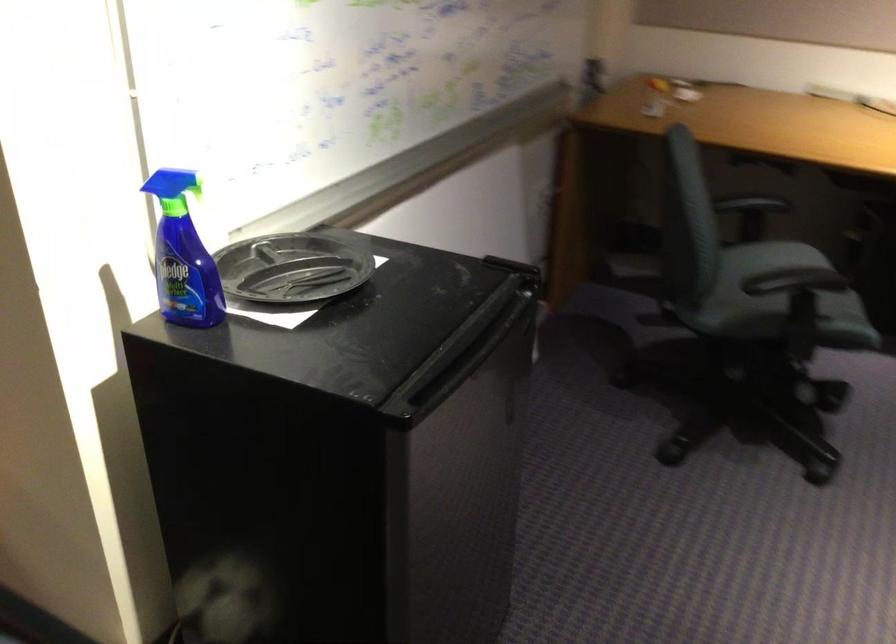
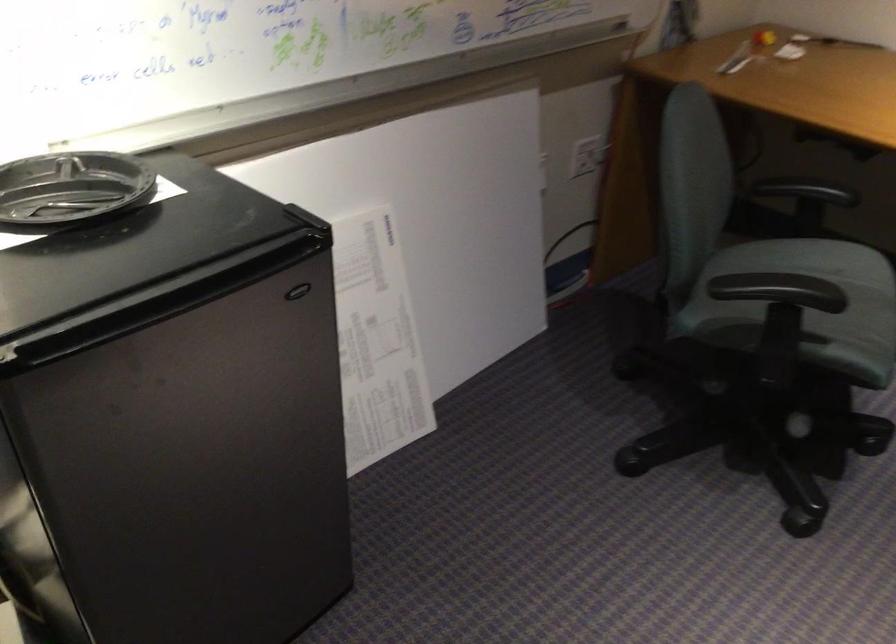
Question: Based on the continuous images, in which direction is the camera rotating? Reply with the corresponding letter.

Choices:
 (A) Left
 (B) Right
 (C) Up
 (D) Down

Answer: (A)